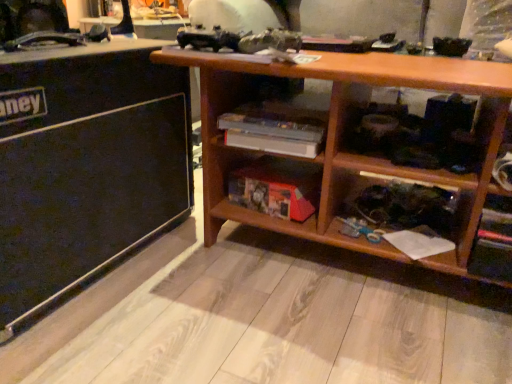
Find the location of a particular element. This screenshot has width=512, height=384. vacant area on top of wooden bookshelf at lower center (from a real-world perspective) is located at coordinates (280, 168).